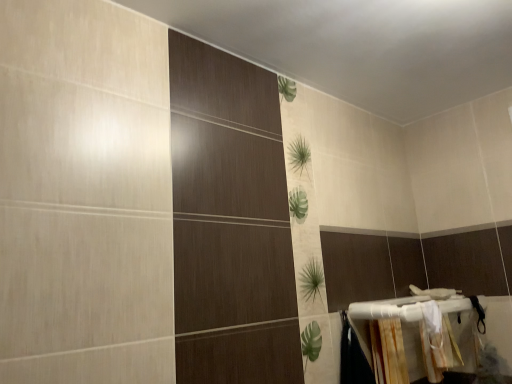
Describe the element at coordinates (388, 351) in the screenshot. I see `wooden at right` at that location.

Find the location of a particular element. The image size is (512, 384). wooden at right is located at coordinates (388, 351).

At what (x,y) coordinates should I click in order to perform the action: click on wooden at right. Please return your answer as a coordinate pair (x, y). The width and height of the screenshot is (512, 384). Looking at the image, I should click on (388, 351).